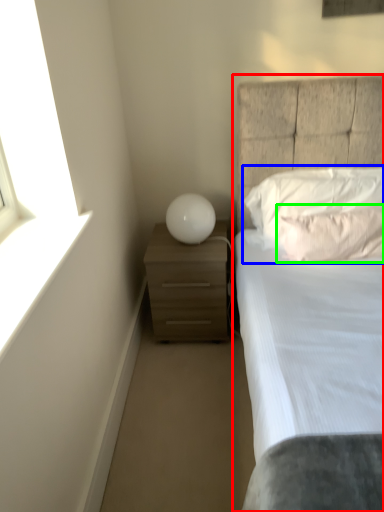
Question: Estimate the real-world distances between objects in this image. Which object is farther from bed (highlighted by a red box), pillow (highlighted by a blue box) or pillow (highlighted by a green box)?

Choices:
 (A) pillow
 (B) pillow

Answer: (B)